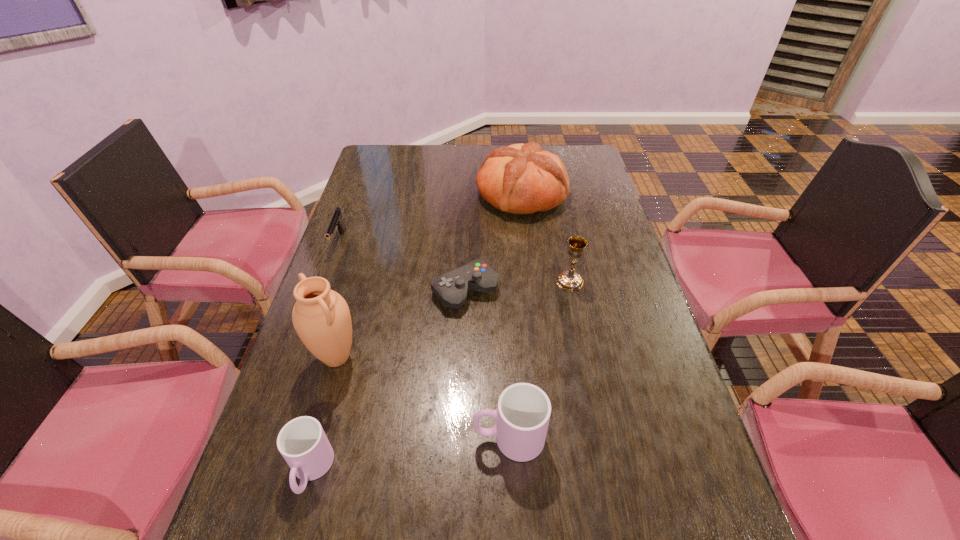
Where is `the fifth tallest object`? This screenshot has height=540, width=960. the fifth tallest object is located at coordinates point(302,442).

You are a GUI agent. You are given a task and a screenshot of the screen. Output one action in this format:
    pyautogui.click(x=<x>, y=<y>)
    Task: Click on the shorter cup
    The image size is (960, 540).
    Given the screenshot: What is the action you would take?
    pyautogui.click(x=302, y=442)

Where is `the right cup`? the right cup is located at coordinates (523, 412).

Image resolution: width=960 pixels, height=540 pixels. I want to click on bread, so point(523,179).

Image resolution: width=960 pixels, height=540 pixels. Identify the location of pistol. (336, 221).

Image resolution: width=960 pixels, height=540 pixels. What are the coordinates of `the sixth tallest object` in the screenshot? It's located at (336, 221).

Identify the location of chalice. (569, 280).

You are a GUI agent. You are given a task and a screenshot of the screen. Output one action in this format:
    pyautogui.click(x=<x>, y=<y>)
    Task: Click on the urn
    The image size is (960, 540).
    Given the screenshot: What is the action you would take?
    pyautogui.click(x=321, y=317)

Locate an element on the screen. This screenshot has width=960, height=540. the tallest object is located at coordinates (321, 317).

This screenshot has width=960, height=540. What are the coordinates of `the shortest object` in the screenshot? It's located at (451, 288).